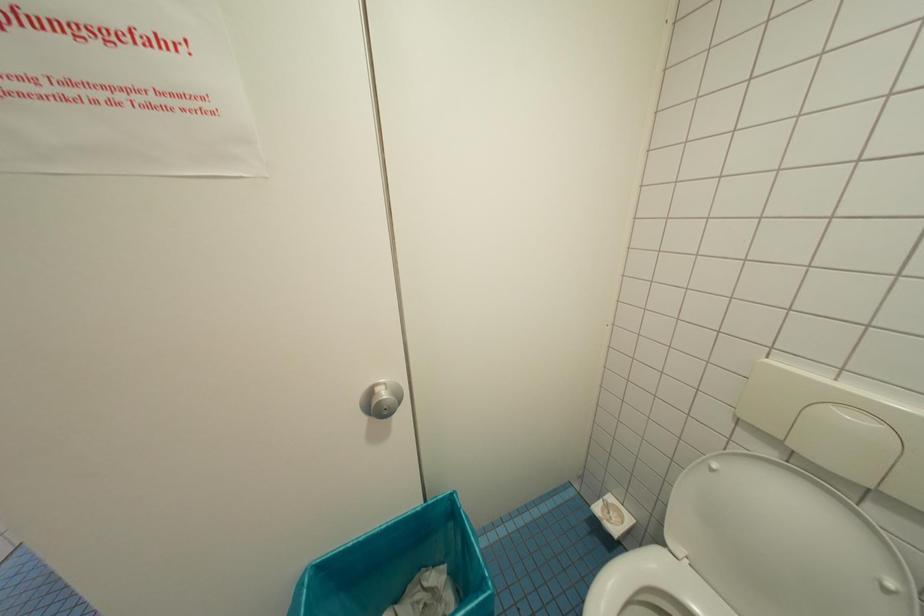
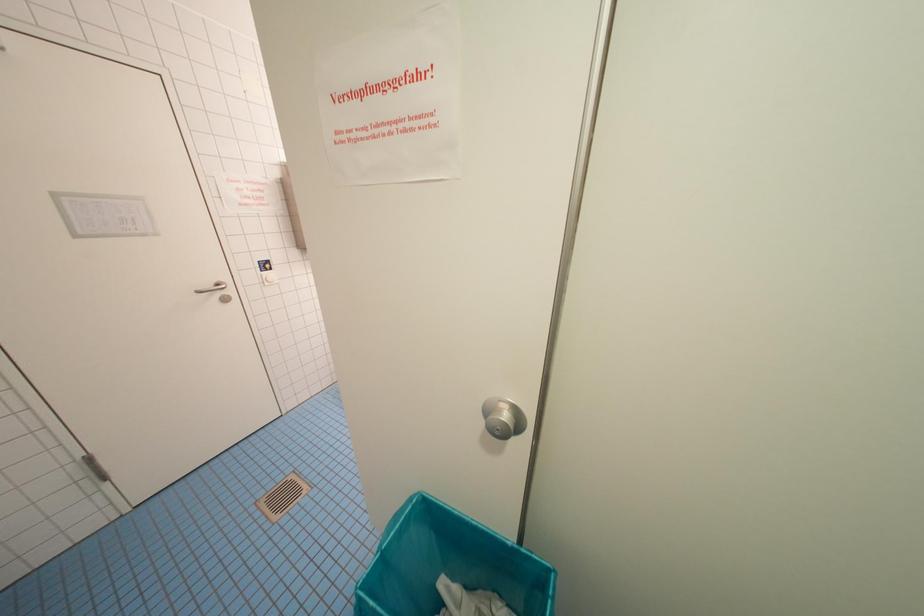
Question: The camera is either moving clockwise (left) or counter-clockwise (right) around the object. The first image is from the beginning of the video and the second image is from the end. Is the camera moving left or right when shooting the video?

Choices:
 (A) Left
 (B) Right

Answer: (B)